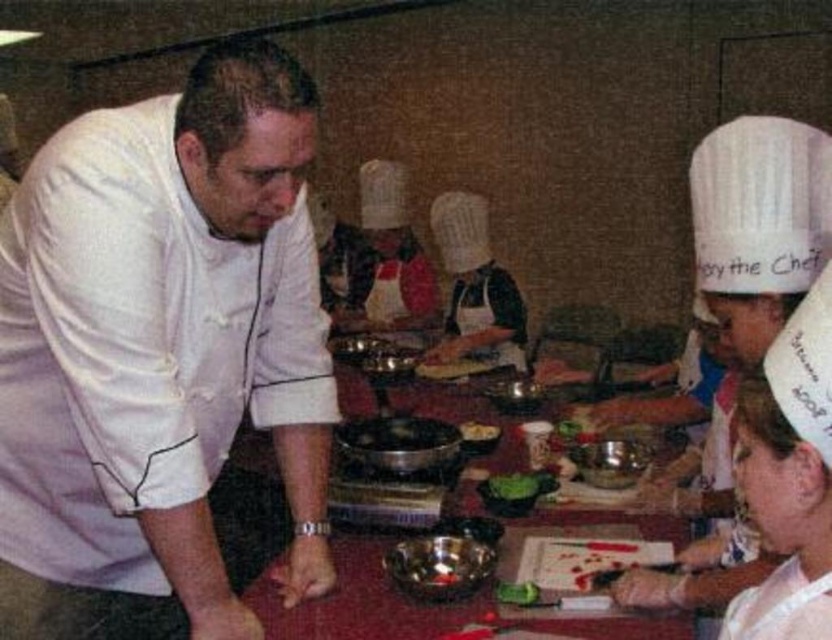
Question: Which point appears closest to the camera in this image?

Choices:
 (A) (494, 429)
 (B) (340, 552)
 (C) (215, 289)
 (D) (441, 365)

Answer: (C)

Question: Which point is farther from the camera taking this photo?

Choices:
 (A) (464, 420)
 (B) (3, 616)
 (C) (671, 627)

Answer: (A)

Question: Can you confirm if white matte chef coat at left is positioned below smooth brown bread at center?

Choices:
 (A) yes
 (B) no

Answer: (A)

Question: Is metallic bowls at center in front of yellow matte cookie at center?

Choices:
 (A) no
 (B) yes

Answer: (B)

Question: Is white matte chef coat at left to the left of metallic bowls at center from the viewer's perspective?

Choices:
 (A) yes
 (B) no

Answer: (A)

Question: Estimate the real-world distances between objects in this image. Which object is closer to the smooth brown bread at center?

Choices:
 (A) metallic bowls at center
 (B) yellow matte cookie at center
 (C) white matte chef coat at left

Answer: (A)